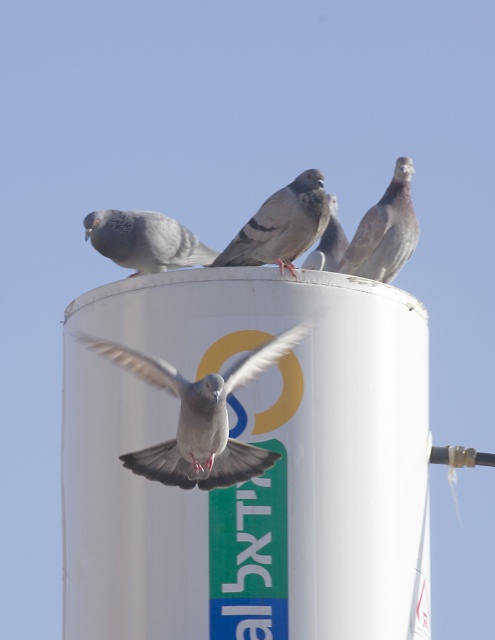
You are observing the pigeons on top of the cylindrical structure. Which pigeon is taller between the gray feathered pigeon at center and the gray matte pigeon at center?

The gray feathered pigeon at center is taller than the gray matte pigeon at center.

You are a birdwatcher observing the scene. You notice two pigeons, the gray feathered pigeon at center and the rusty feathered pigeon at upper right. Which pigeon is sitting lower in the scene?

The gray feathered pigeon at center has a lesser height compared to the rusty feathered pigeon at upper right, so the gray feathered pigeon at center is sitting lower in the scene.

You are a birdwatcher observing the scene. You notice two pigeons on the cylinder structure. Which pigeon, the gray matte pigeon at upper left or the rusty feathered pigeon at upper right, is closer to you?

The gray matte pigeon at upper left is closer to you because it is in front of the rusty feathered pigeon at upper right.